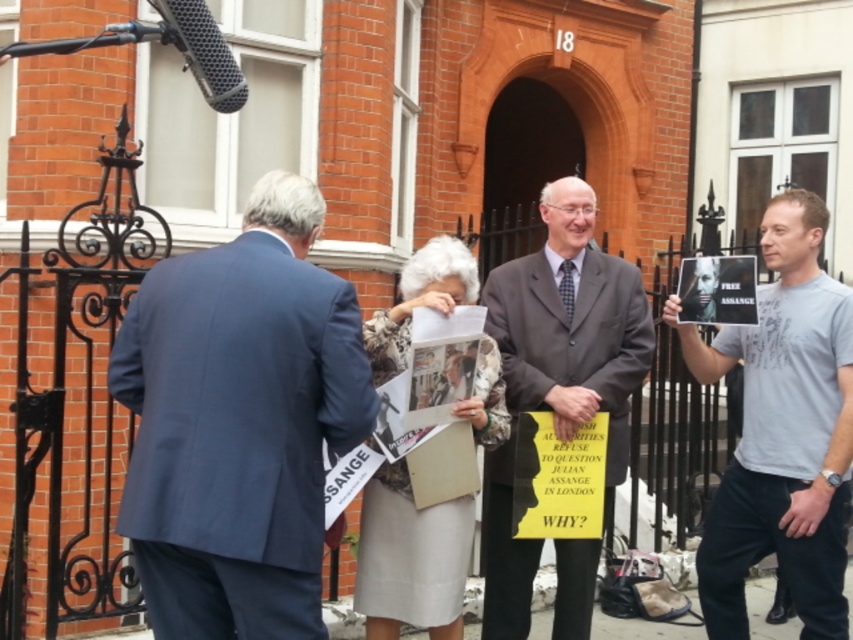
You are a photographer standing in front of the building and want to take a photo that includes both the dark blue suit at left and the dark gray suit at center. Which suit will appear larger in the photo?

The dark blue suit at left will appear larger in the photo because it is closer to the viewer than the dark gray suit at center.

You are a photographer standing in front of the building. You want to take a picture that includes both the dark blue suit at left and the dark gray suit at center. Which person should you focus on first to ensure both are in frame?

You should focus on the dark gray suit at center first because it is taller than the dark blue suit at left, so adjusting the camera angle to include the taller individual will naturally include the shorter one as well.